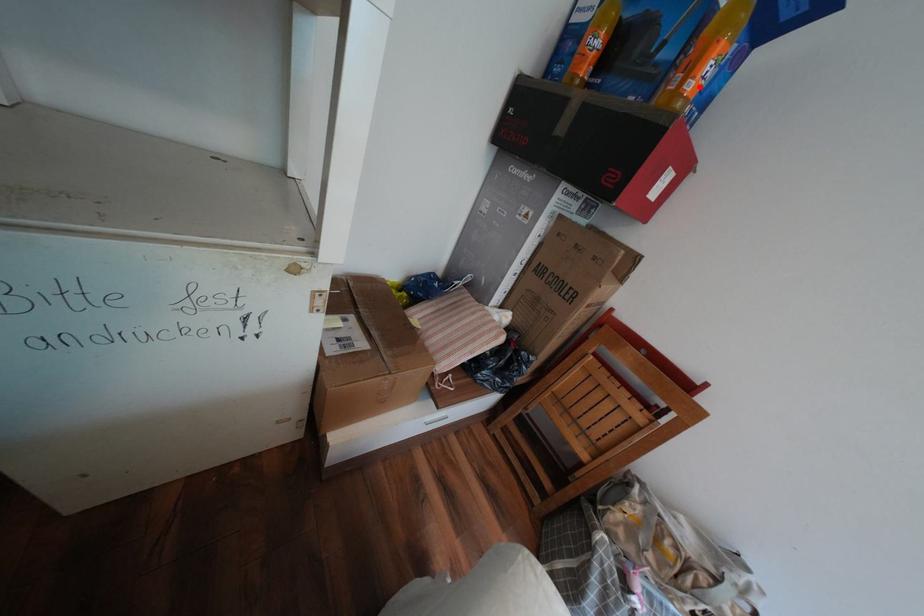
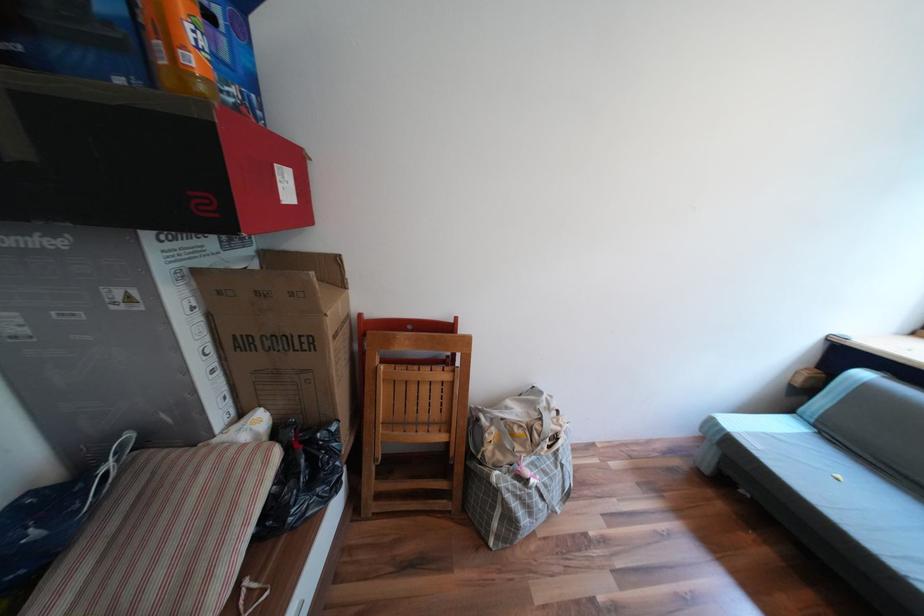
Find the pixel in the second image that matches the highlighted location in the first image.

(201, 61)